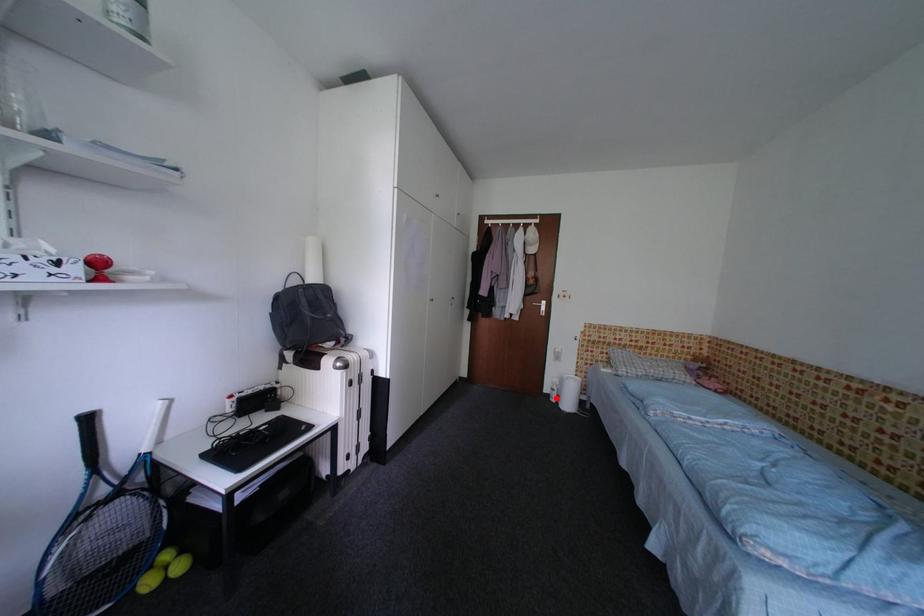
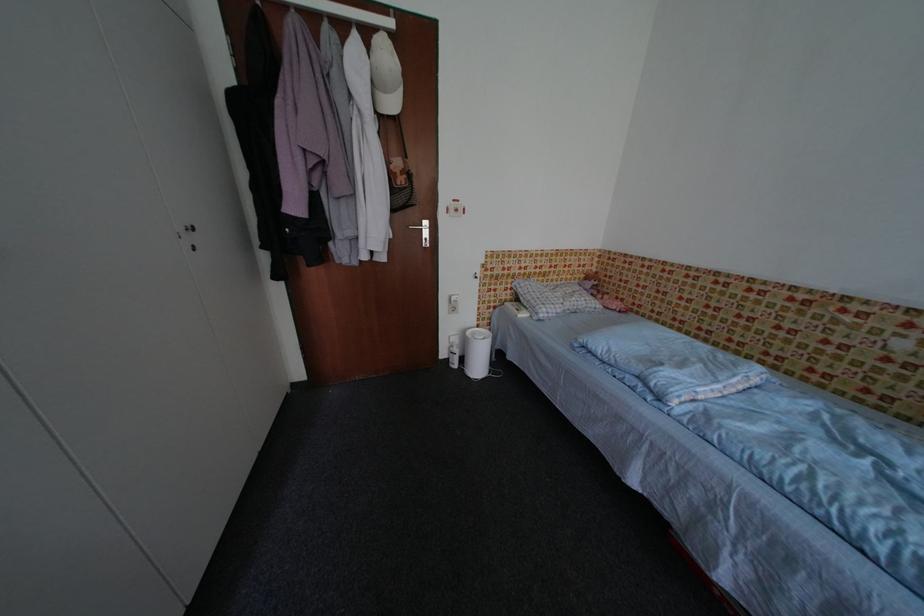
The point at the highlighted location is marked in the first image. Where is the corresponding point in the second image?

(455, 363)